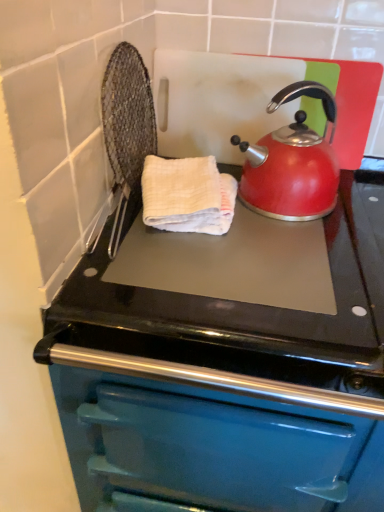
The height and width of the screenshot is (512, 384). Find the location of `vacant space situated above teal enamel oven at center (from a real-world perspective)`. vacant space situated above teal enamel oven at center (from a real-world perspective) is located at coordinates (286, 257).